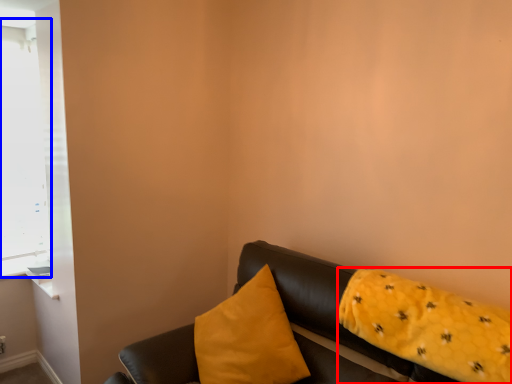
Question: Among these objects, which one is farthest to the camera, pillow (highlighted by a red box) or window (highlighted by a blue box)?

Choices:
 (A) pillow
 (B) window

Answer: (B)